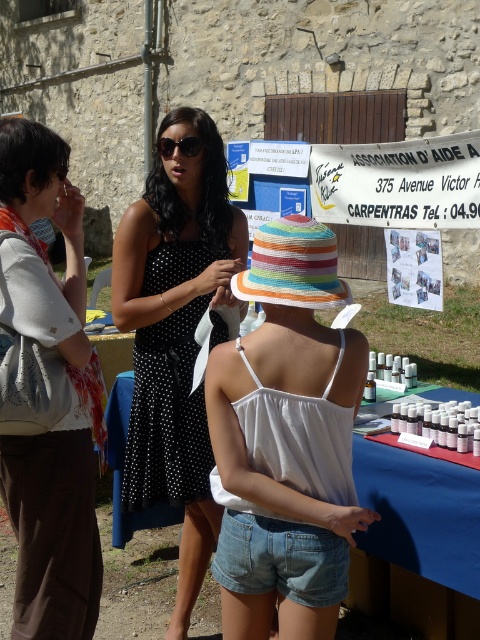
You are standing at the point marked by coordinates point (176, 333). Which object are you closest to?

The point (176, 333) is on the black dotted dress at center, so you are closest to the black dotted dress at center.

From the picture: You are a photographer at the event and want to capture a photo of the black dotted dress at center without the blue fabric table at center appearing in the background. Is this possible?

The black dotted dress at center is above the blue fabric table at center, so yes, the photographer can position the camera to capture the black dotted dress at center while keeping the blue fabric table at center out of the frame by angling the shot downward.